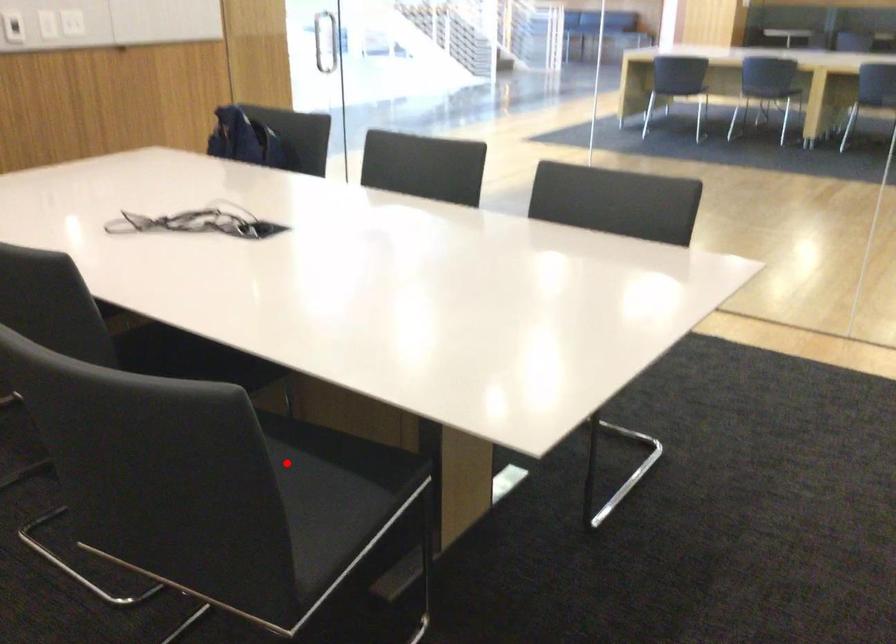
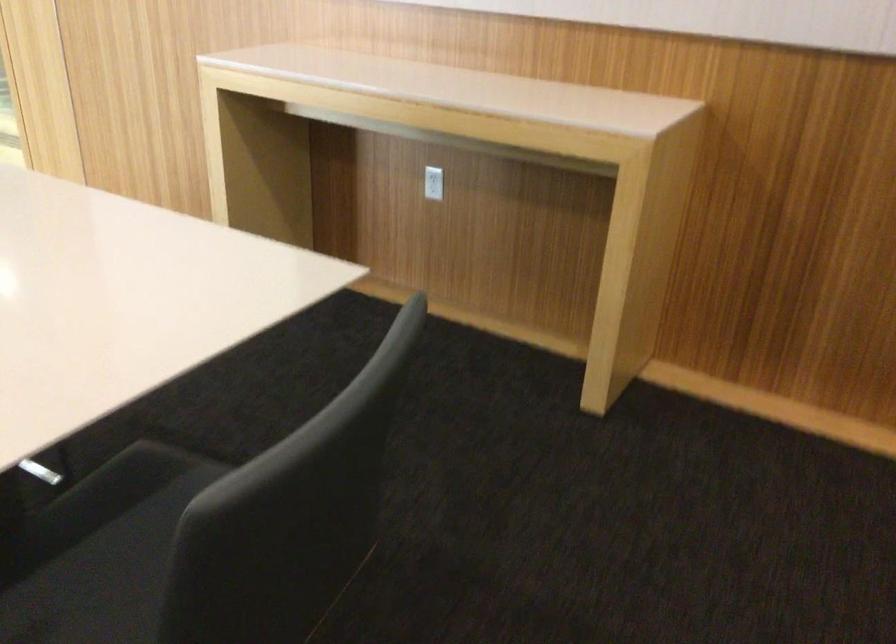
The point at the highlighted location is marked in the first image. Where is the corresponding point in the second image?

(101, 551)